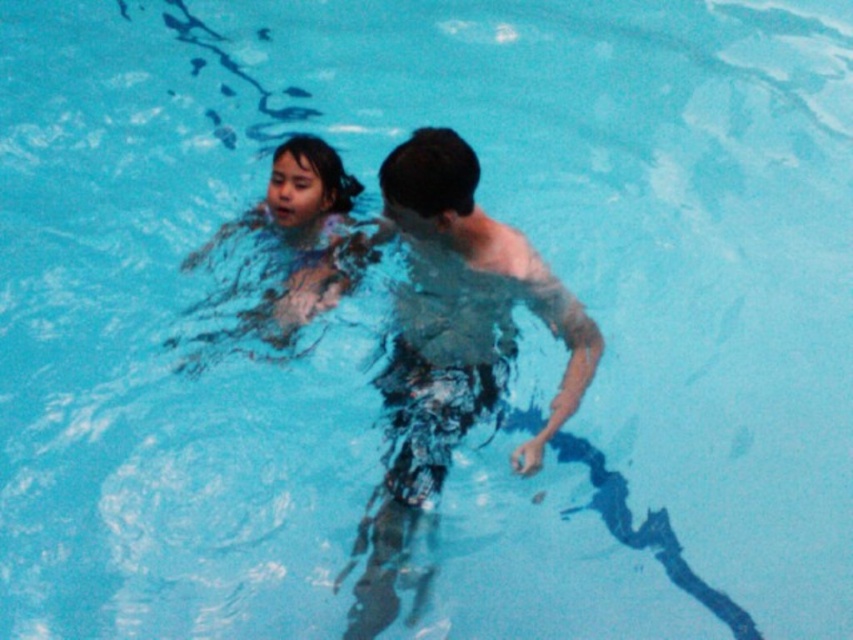
Between translucent wet hair at upper center and smooth skin child at center, which one is positioned lower?

translucent wet hair at upper center is below.

Identify the location of translucent wet hair at upper center. This screenshot has height=640, width=853. (451, 344).

What do you see at coordinates (451, 344) in the screenshot? This screenshot has width=853, height=640. I see `translucent wet hair at upper center` at bounding box center [451, 344].

Where is `translucent wet hair at upper center`? This screenshot has width=853, height=640. translucent wet hair at upper center is located at coordinates (451, 344).